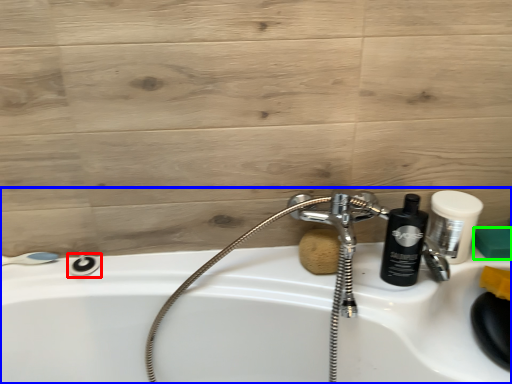
Question: Which object is positioned farthest from shower (highlighted by a red box)? Select from sink (highlighted by a blue box) and soap (highlighted by a green box).

Choices:
 (A) sink
 (B) soap

Answer: (B)